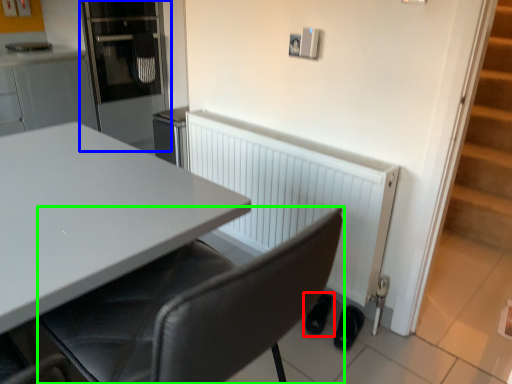
Question: Considering the real-world distances, which object is farthest from footwear (highlighted by a red box)? appliance (highlighted by a blue box) or chair (highlighted by a green box)?

Choices:
 (A) appliance
 (B) chair

Answer: (A)